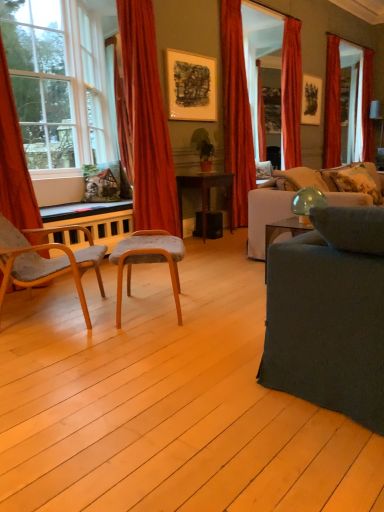
Image resolution: width=384 pixels, height=512 pixels. In order to click on free space on the front side of wooden chair at left, marked as the 1th chair in a left-to-right arrangement in this screenshot , I will do `click(55, 357)`.